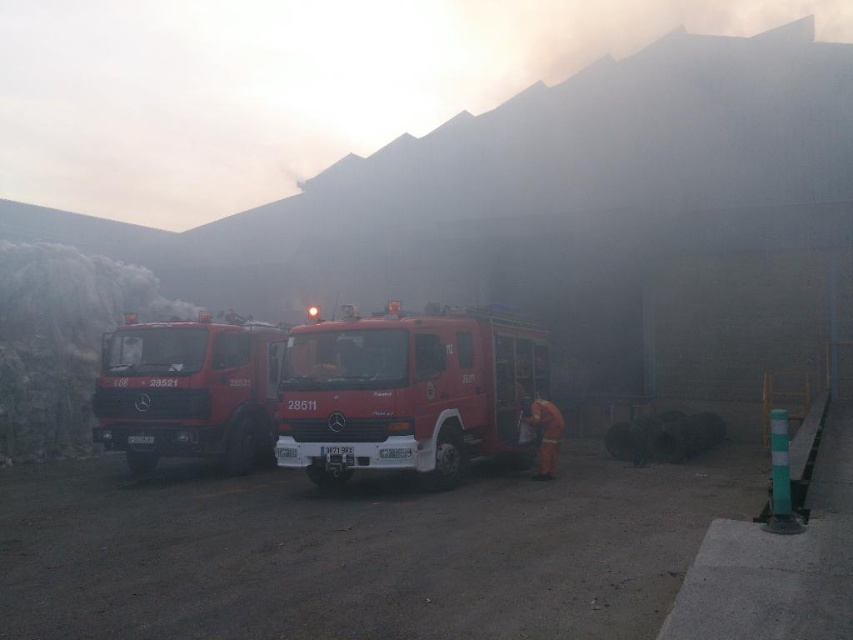
You are a firefighter who needs to reach a high shelf in the fire station to retrieve a safety manual. You have access to both the shiny red fire truck at center and the matte red fire truck at center. Which truck should you use to reach the shelf?

The matte red fire truck at center is taller than the shiny red fire truck at center, so you should use the matte red fire truck at center to reach the high shelf.

You are a firefighter trying to reach the orange fabric fireman at center to deliver an emergency kit. The matte red fire truck at center is blocking your path. Can you walk around the truck to reach the fireman?

The matte red fire truck at center is closer to the viewer than the orange fabric fireman at center, so you can walk around the truck to reach the fireman.

You are a drone operator trying to capture a clear aerial shot of the shiny red fire truck at center and the orange fabric fireman at center. Which object is wider?

The shiny red fire truck at center is wider than the orange fabric fireman at center.